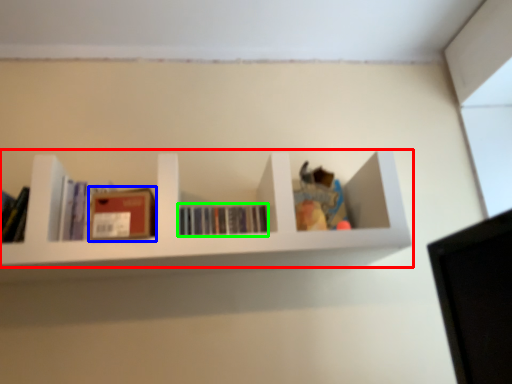
Question: Which object is positioned closest to shelf (highlighted by a red box)? Select from paperback book (highlighted by a blue box) and book (highlighted by a green box).

Choices:
 (A) paperback book
 (B) book

Answer: (B)